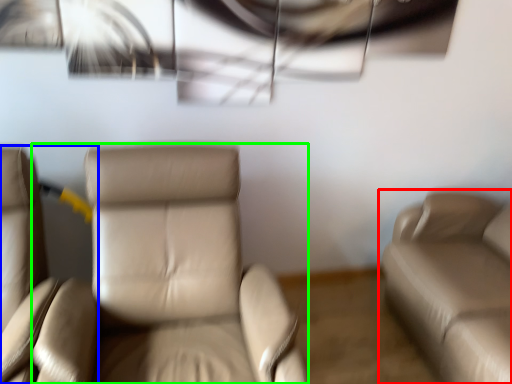
Question: Which object is positioned farthest from studio couch (highlighted by a red box)? Select from chair (highlighted by a blue box) and chair (highlighted by a green box).

Choices:
 (A) chair
 (B) chair

Answer: (A)